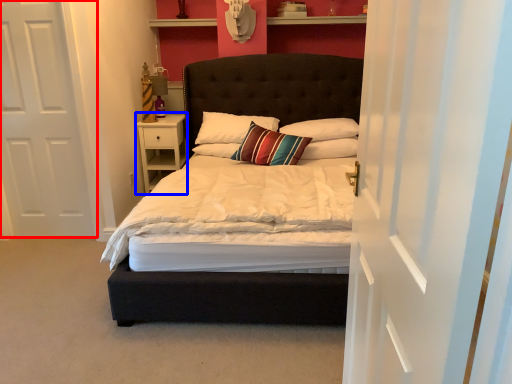
Question: Which point is closer to the camera, door (highlighted by a red box) or nightstand (highlighted by a blue box)?

Choices:
 (A) door
 (B) nightstand

Answer: (A)